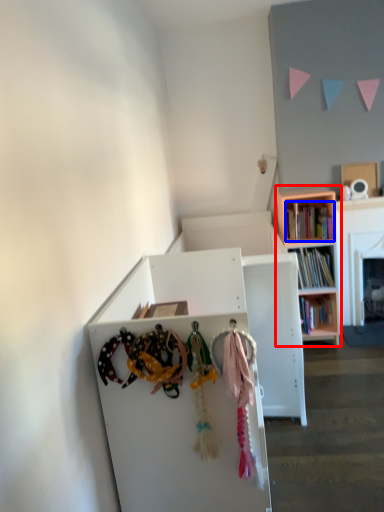
Question: Which of the following is the closest to the observer, bookcase (highlighted by a red box) or book (highlighted by a blue box)?

Choices:
 (A) bookcase
 (B) book

Answer: (A)